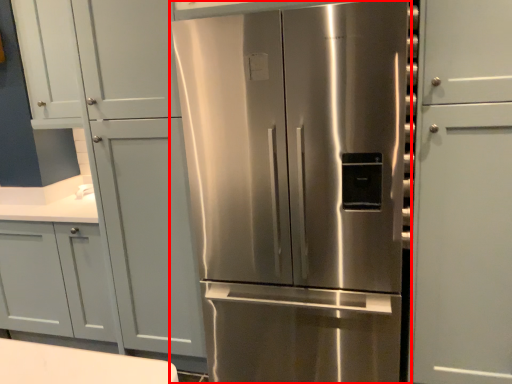
Question: In this image, where is refrigerator (annotated by the red box) located relative to door?

Choices:
 (A) left
 (B) right

Answer: (B)